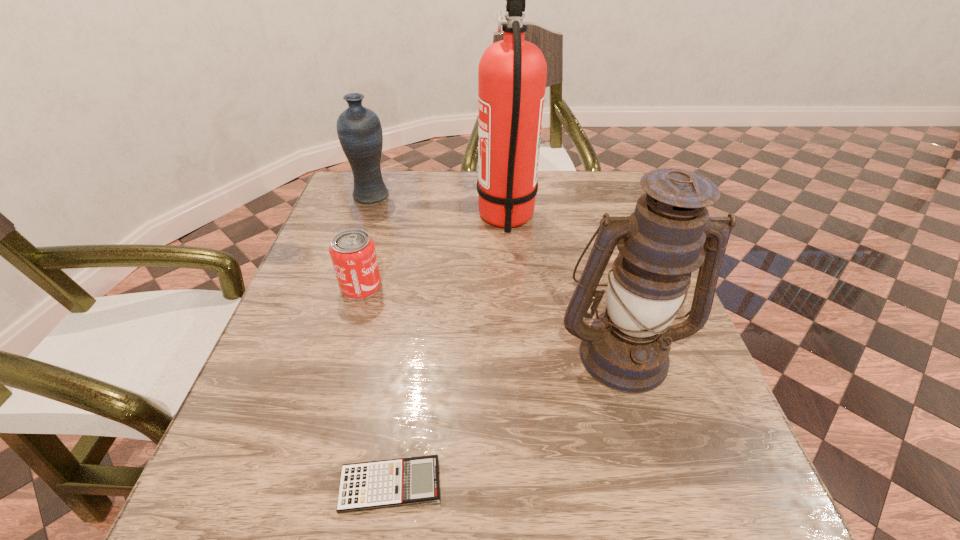
Locate an element on the screen. The width and height of the screenshot is (960, 540). vacant area between the second nearest object and the can is located at coordinates (492, 320).

At what (x,y) coordinates should I click in order to perform the action: click on vacant region between the oil lamp and the vase. Please return your answer as a coordinate pair (x, y). This screenshot has height=540, width=960. Looking at the image, I should click on (496, 274).

Locate an element on the screen. free spot between the vase and the oil lamp is located at coordinates (496, 274).

The image size is (960, 540). What are the coordinates of `vacant space that is in between the can and the fire extinguisher` in the screenshot? It's located at (434, 253).

Where is `blank region between the calculator and the second tallest object`? The image size is (960, 540). blank region between the calculator and the second tallest object is located at coordinates (506, 419).

Identify the location of object identified as the third closest to the nearest object. The image size is (960, 540). (512, 73).

Where is `object that is the fourth nearest to the fourth tallest object`? object that is the fourth nearest to the fourth tallest object is located at coordinates (626, 348).

The height and width of the screenshot is (540, 960). Find the location of `free space that satisfies the following two spatial constraints: 1. on the handle side of the fire extinguisher; 2. on the front side of the second shortest object`. free space that satisfies the following two spatial constraints: 1. on the handle side of the fire extinguisher; 2. on the front side of the second shortest object is located at coordinates (512, 287).

Locate an element on the screen. The height and width of the screenshot is (540, 960). free space that satisfies the following two spatial constraints: 1. on the back side of the nearest object; 2. on the right side of the fourth shortest object is located at coordinates click(x=410, y=353).

This screenshot has height=540, width=960. In order to click on vacant space that satisfies the following two spatial constraints: 1. on the back side of the fourth farthest object; 2. on the handle side of the fire extinguisher in this screenshot , I will do `click(582, 219)`.